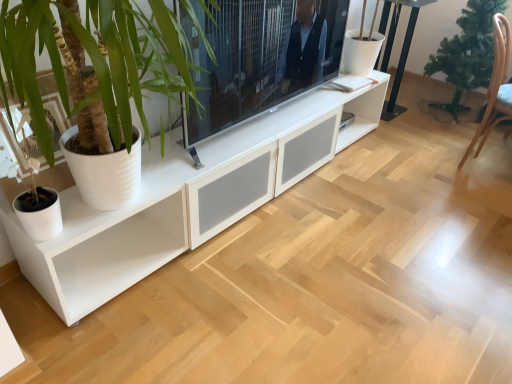
This screenshot has width=512, height=384. What are the coordinates of `vacant area that is in front of green matte christmas tree at right` in the screenshot? It's located at (445, 137).